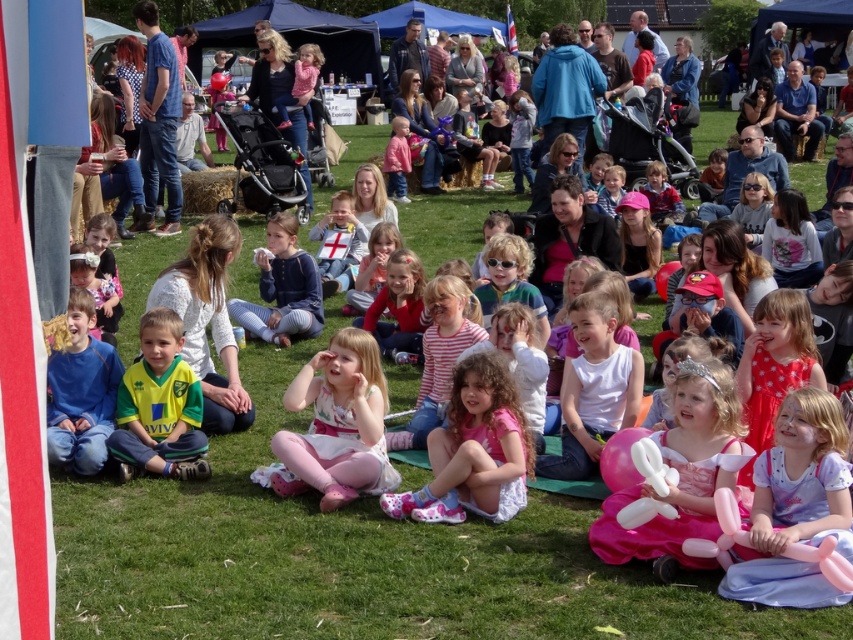
Is pink fabric dress at center above blue striped pants at center?

Incorrect, pink fabric dress at center is not positioned above blue striped pants at center.

This screenshot has height=640, width=853. Describe the element at coordinates (473, 451) in the screenshot. I see `pink fabric dress at center` at that location.

The image size is (853, 640). I want to click on pink fabric dress at center, so click(x=473, y=451).

Who is higher up, pink fabric dress at center or white matte shirt at center?

white matte shirt at center is higher up.

You are a GUI agent. You are given a task and a screenshot of the screen. Output one action in this format:
    pyautogui.click(x=<x>, y=<y>)
    Task: Click on the pink fabric dress at center
    The image size is (853, 640).
    Given the screenshot: What is the action you would take?
    pyautogui.click(x=473, y=451)

This screenshot has height=640, width=853. Identify the location of pink fabric dress at center. 473,451.

Is point (502, 470) more distant than point (99, 355)?

No, it is not.

Is pink fabric dress at center positioned in front of blue cotton shirt at lower left?

Yes, pink fabric dress at center is closer to the viewer.

Where is `pink fabric dress at center`? pink fabric dress at center is located at coordinates (473, 451).